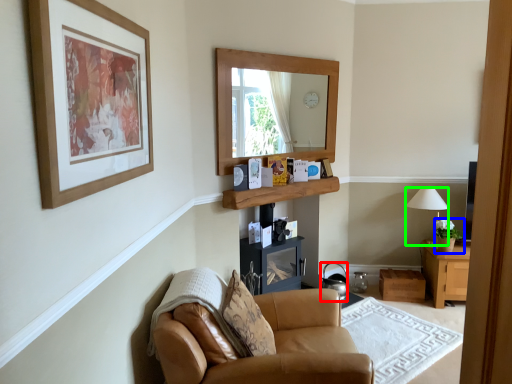
Question: Considering the real-world distances, which object is farthest from kettle (highlighted by a red box)? houseplant (highlighted by a blue box) or lamp (highlighted by a green box)?

Choices:
 (A) houseplant
 (B) lamp

Answer: (B)